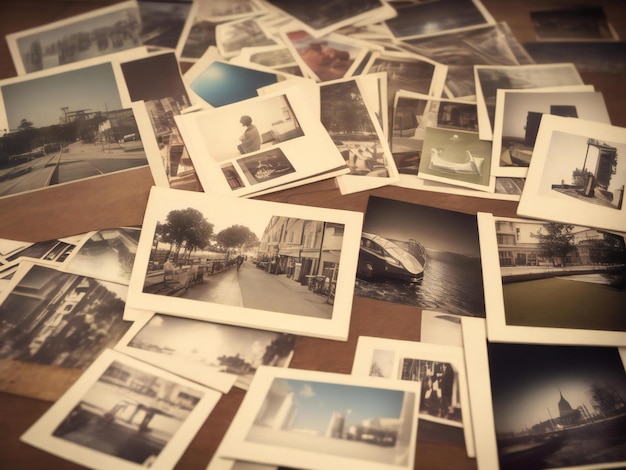
Where is `picture`? picture is located at coordinates (553, 365).